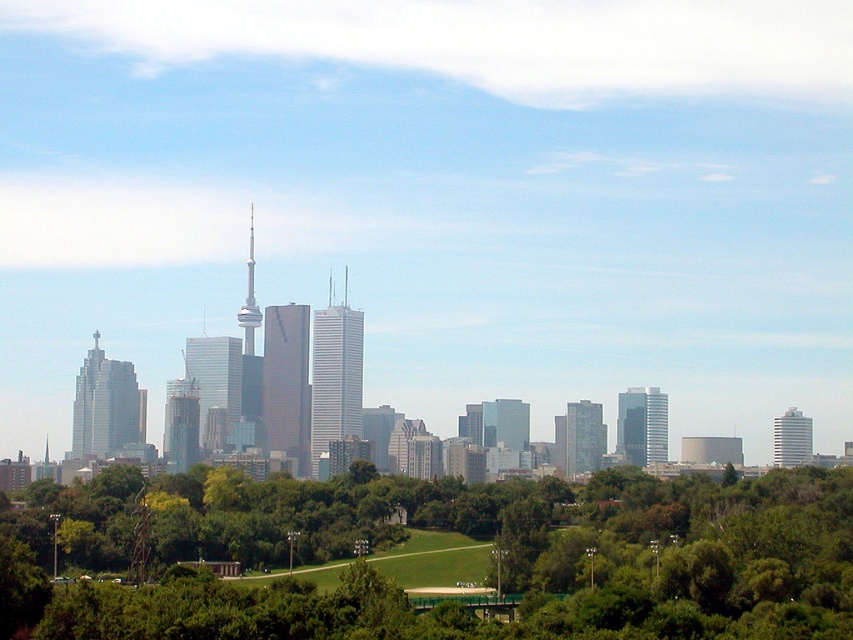
You are standing in the park and looking towards the city skyline. There are two points marked on the ground in front of you. One is at coordinates point (x=227, y=417) and the other is at point (x=245, y=352). Which point is closer to you?

Point (x=245, y=352) is closer to you because it is in front of point (x=227, y=417).

You are standing in the park and looking at the city skyline. You see the glassy reflective skyscraper at center and the shiny glass tower at center. Which one is located to the left when viewed from your position?

A: The glassy reflective skyscraper at center is positioned on the left side of the shiny glass tower at center, so it is located to the left when viewed from your position in the park.